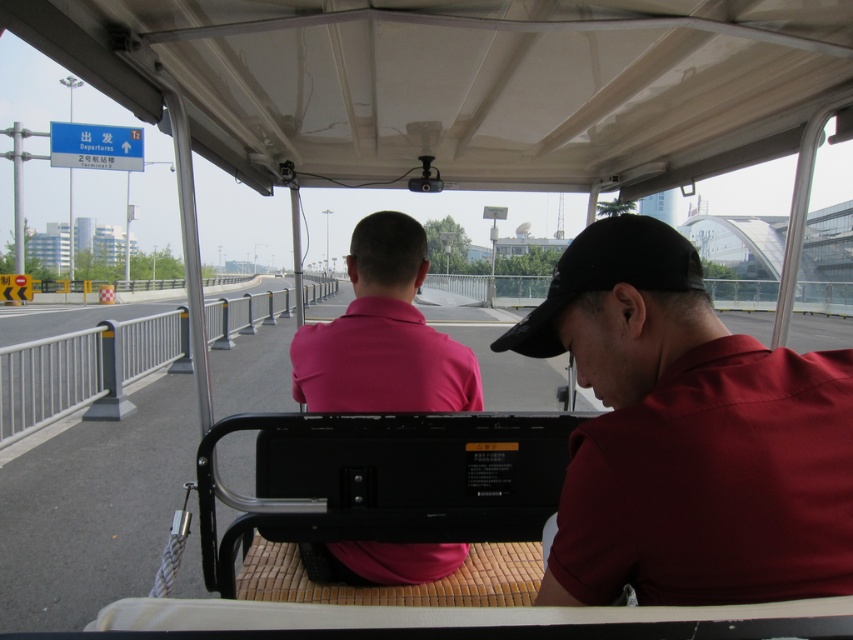
You are sitting in the back seat of the vehicle and want to look at two specific points on the road ahead. The first point is at coordinates point (834, 392) and the second point is at point (436, 397). Which of these two points is closer to you?

Point (834, 392) is in front of point (436, 397), so the point closer to you is point (436, 397).

You are sitting in the back seat of a small vehicle and want to reach a point that is 89.90 centimeters away from you. The point is located at coordinates point [585,449]. Can you comfortably reach it while staying seated?

The point at point [585,449] is 89.90 centimeters away from you. Since the average comfortable reaching distance for an adult while seated is about 75 centimeters, reaching 89.90 centimeters might be slightly uncomfortable but still possible with stretching.